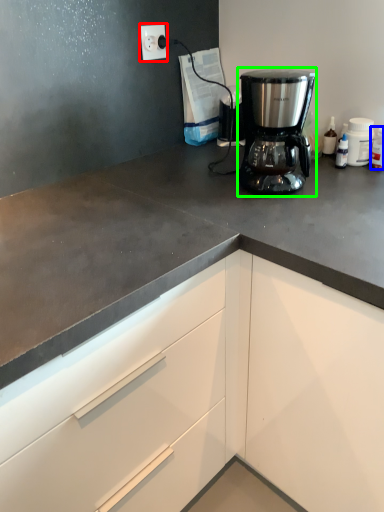
Question: Which object is the closest to the electric outlet (highlighted by a red box)? Choose among these: bottle (highlighted by a blue box) or coffee maker (highlighted by a green box).

Choices:
 (A) bottle
 (B) coffee maker

Answer: (B)